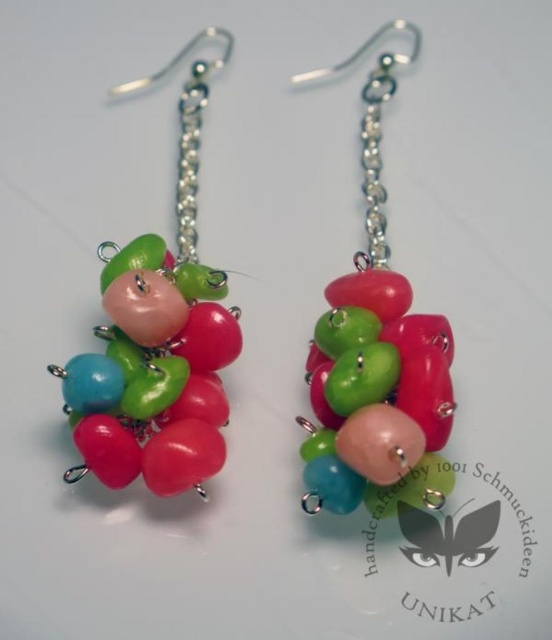
You are an earring designer examining the displayed earrings. You notice two groups of beads labeled as matte plastic beads at left and matte plastic beads at center. Which group has a greater height?

The matte plastic beads at center are taller than the matte plastic beads at left.

You are a jeweler examining the handmade earrings. You notice a specific point at coordinates point [158,337]. Based on the description, what material is this point located on?

The point [158,337] is on matte plastic beads at left.